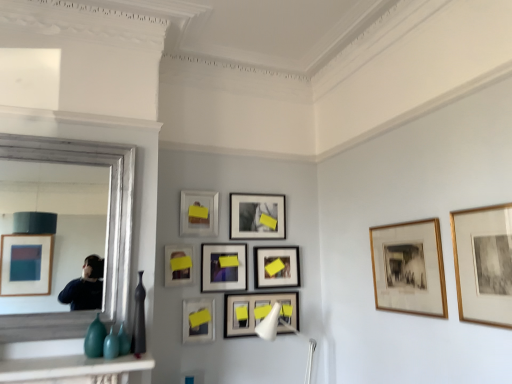
Question: Considering the relative sizes of matte black picture frame at center, positioned as the 2th picture frame in back-to-front order, and white plastic lamp at center in the image provided, is matte black picture frame at center, positioned as the 2th picture frame in back-to-front order, bigger than white plastic lamp at center?

Choices:
 (A) yes
 (B) no

Answer: (B)

Question: Considering the relative sizes of matte black picture frame at center, which is the eighth picture frame from front to back, and white plastic lamp at center in the image provided, is matte black picture frame at center, which is the eighth picture frame from front to back, wider than white plastic lamp at center?

Choices:
 (A) no
 (B) yes

Answer: (A)

Question: Could you tell me if matte black picture frame at center, which is the eighth picture frame from front to back, is facing white plastic lamp at center?

Choices:
 (A) yes
 (B) no

Answer: (B)

Question: Considering the relative sizes of matte black picture frame at center, which is the eighth picture frame from front to back, and white plastic lamp at center in the image provided, is matte black picture frame at center, which is the eighth picture frame from front to back, thinner than white plastic lamp at center?

Choices:
 (A) yes
 (B) no

Answer: (A)

Question: Considering the relative positions of matte black picture frame at center, positioned as the 2th picture frame in back-to-front order, and white plastic lamp at center in the image provided, is matte black picture frame at center, positioned as the 2th picture frame in back-to-front order, to the right of white plastic lamp at center from the viewer's perspective?

Choices:
 (A) yes
 (B) no

Answer: (B)

Question: Would you say silver framed mirror at left is to the left or to the right of matte glass picture frame at center, marked as the sixth picture frame in a back-to-front arrangement, in the picture?

Choices:
 (A) left
 (B) right

Answer: (A)

Question: Considering the positions of point (57, 233) and point (189, 253), is point (57, 233) closer or farther from the camera than point (189, 253)?

Choices:
 (A) closer
 (B) farther

Answer: (B)

Question: Considering the positions of silver framed mirror at left and matte glass picture frame at center, marked as the sixth picture frame in a back-to-front arrangement, in the image, is silver framed mirror at left taller or shorter than matte glass picture frame at center, marked as the sixth picture frame in a back-to-front arrangement,?

Choices:
 (A) tall
 (B) short

Answer: (A)

Question: From the image's perspective, is silver framed mirror at left positioned above or below matte glass picture frame at center, marked as the sixth picture frame in a back-to-front arrangement?

Choices:
 (A) below
 (B) above

Answer: (B)

Question: From the image's perspective, is teal glass vase at lower left above or below silver framed mirror at left?

Choices:
 (A) above
 (B) below

Answer: (B)

Question: Relative to silver framed mirror at left, is teal glass vase at lower left in front or behind?

Choices:
 (A) behind
 (B) front

Answer: (A)

Question: From a real-world perspective, is teal glass vase at lower left above or below silver framed mirror at left?

Choices:
 (A) above
 (B) below

Answer: (B)

Question: In terms of height, does teal glass vase at lower left look taller or shorter compared to silver framed mirror at left?

Choices:
 (A) tall
 (B) short

Answer: (B)

Question: In the image, is gold-framed print at center-right, marked as the 8th picture frame in a back-to-front arrangement, positioned in front of or behind matte black vase at left?

Choices:
 (A) front
 (B) behind

Answer: (A)

Question: Considering the relative positions of gold-framed print at center-right, marked as the 8th picture frame in a back-to-front arrangement, and matte black vase at left in the image provided, is gold-framed print at center-right, marked as the 8th picture frame in a back-to-front arrangement, to the left or to the right of matte black vase at left?

Choices:
 (A) left
 (B) right

Answer: (B)